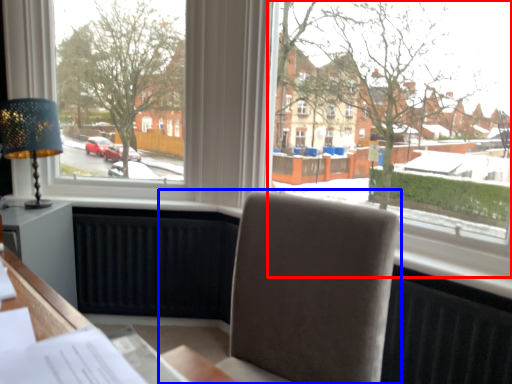
Question: Among these objects, which one is farthest to the camera, window (highlighted by a red box) or chair (highlighted by a blue box)?

Choices:
 (A) window
 (B) chair

Answer: (A)